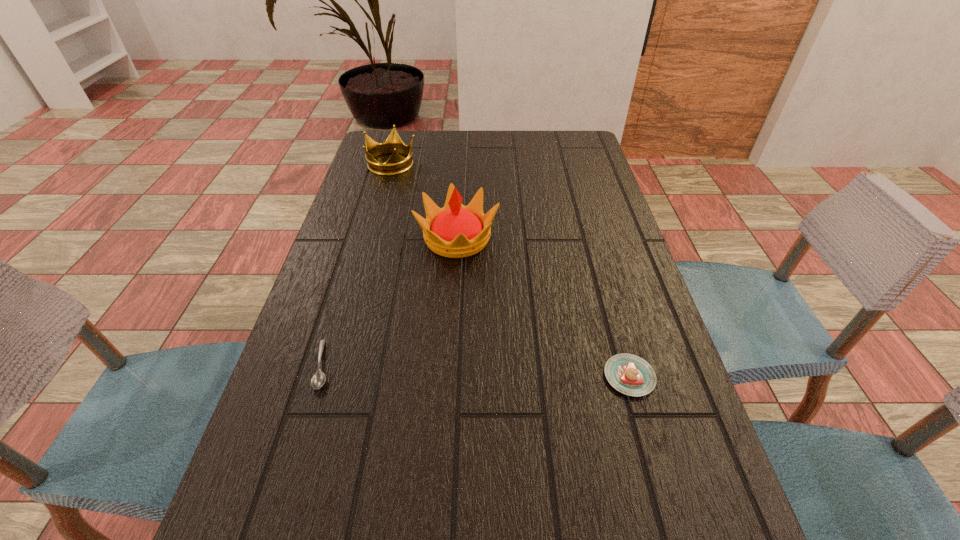
The width and height of the screenshot is (960, 540). What are the coordinates of `the right crown` in the screenshot? It's located at (455, 231).

This screenshot has width=960, height=540. I want to click on the taller crown, so click(x=455, y=231).

The height and width of the screenshot is (540, 960). I want to click on the shorter crown, so click(396, 164).

Where is `the farther crown`? The image size is (960, 540). the farther crown is located at coordinates (x=396, y=164).

This screenshot has height=540, width=960. I want to click on pastry, so click(x=629, y=374).

The width and height of the screenshot is (960, 540). Find the location of `the rightmost object`. the rightmost object is located at coordinates (629, 374).

Locate an element on the screen. The height and width of the screenshot is (540, 960). soupspoon is located at coordinates (318, 379).

The width and height of the screenshot is (960, 540). What are the coordinates of `vacant region located on the front of the taller crown` in the screenshot? It's located at [450, 349].

Locate an element on the screen. The width and height of the screenshot is (960, 540). free space located on the right of the third shortest object is located at coordinates (517, 163).

Identify the location of vacant space located on the front of the rightmost object. This screenshot has width=960, height=540. (650, 448).